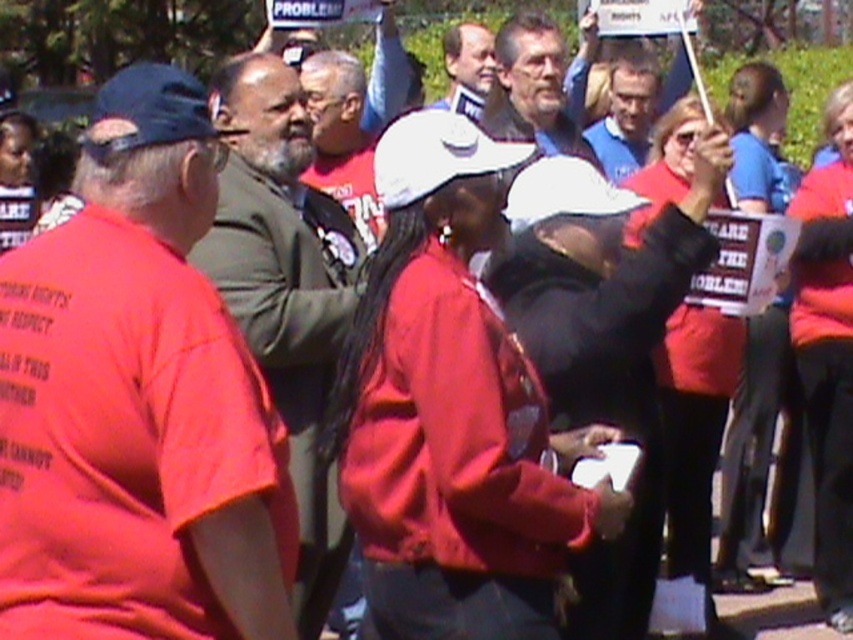
Question: Does gray hair at center lie in front of blue fabric shirt at upper center?

Choices:
 (A) no
 (B) yes

Answer: (B)

Question: Which of the following is the farthest from the observer?

Choices:
 (A) (479, 534)
 (B) (520, 120)
 (C) (305, 307)
 (D) (192, 100)

Answer: (B)

Question: Is matte orange t-shirt at left above gray hair at center?

Choices:
 (A) yes
 (B) no

Answer: (B)

Question: Can you confirm if gray hair at center is positioned to the left of blue fabric shirt at upper center?

Choices:
 (A) no
 (B) yes

Answer: (B)

Question: Which point is farther to the camera?

Choices:
 (A) (74, 352)
 (B) (602, 157)

Answer: (B)

Question: Which object is positioned farthest from the green textured jacket at center?

Choices:
 (A) blue fabric shirt at upper center
 (B) matte orange t-shirt at left

Answer: (A)